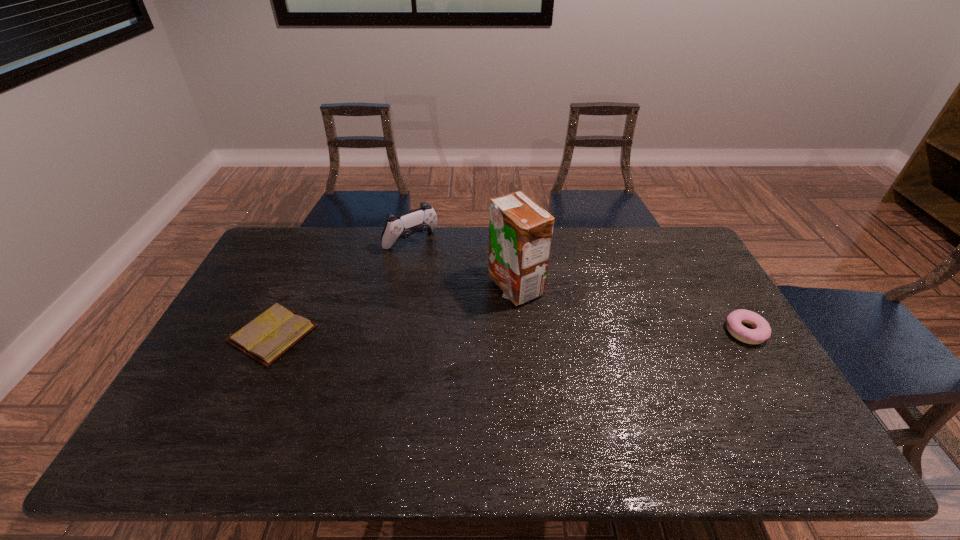
Locate an element on the screen. Image resolution: width=960 pixels, height=540 pixels. vacant space located on the straw side of the third object from left to right is located at coordinates (490, 348).

The height and width of the screenshot is (540, 960). In order to click on free space located 0.120m on the straw side of the third object from left to right in this screenshot , I will do `click(495, 335)`.

Locate an element on the screen. The image size is (960, 540). vacant area situated 0.390m on the straw side of the third object from left to right is located at coordinates (462, 414).

The width and height of the screenshot is (960, 540). I want to click on free spot located 0.370m on the front-facing side of the control, so click(483, 315).

What are the coordinates of `vacant space located on the front-facing side of the control` in the screenshot? It's located at point(465,296).

Where is `vacant space situated 0.220m on the front-facing side of the control`? This screenshot has height=540, width=960. vacant space situated 0.220m on the front-facing side of the control is located at coordinates (457, 288).

Identify the location of carton present at the far edge. (520, 231).

I want to click on control located in the far edge section of the desktop, so click(423, 219).

Locate an element on the screen. object located at the left edge is located at coordinates (266, 338).

At what (x,y) coordinates should I click in order to perform the action: click on object that is at the right edge. Please return your answer as a coordinate pair (x, y). This screenshot has width=960, height=540. Looking at the image, I should click on (761, 331).